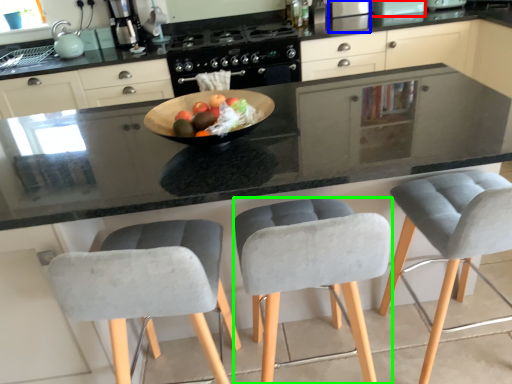
Question: Estimate the real-world distances between objects in this image. Which object is farther from appliance (highlighted by a red box), appliance (highlighted by a blue box) or chair (highlighted by a green box)?

Choices:
 (A) appliance
 (B) chair

Answer: (B)